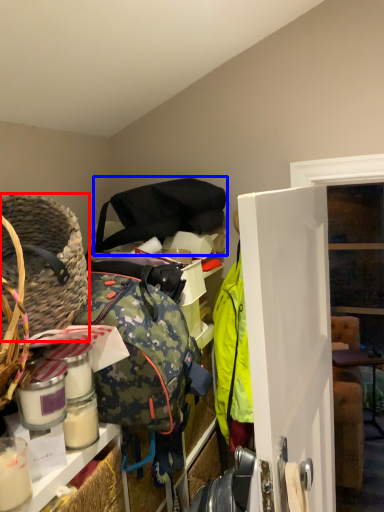
Question: Which point is further to the camera, basket (highlighted by a red box) or shoulder bag (highlighted by a blue box)?

Choices:
 (A) basket
 (B) shoulder bag

Answer: (B)